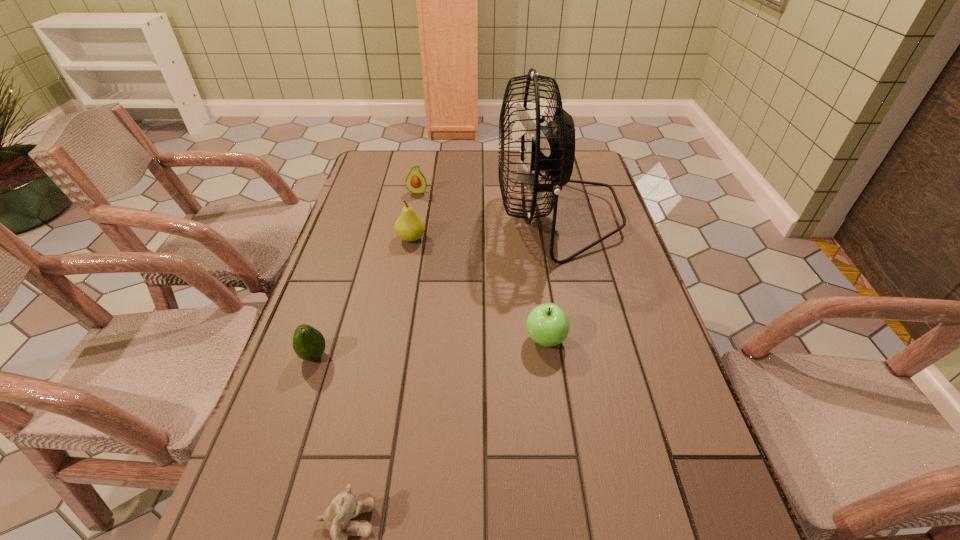
What are the coordinates of `the tallest object` in the screenshot? It's located at (551, 148).

You are a GUI agent. You are given a task and a screenshot of the screen. Output one action in this format:
    pyautogui.click(x=<x>, y=<y>)
    Task: Click on the fifth shortest object
    
    Given the screenshot: What is the action you would take?
    pyautogui.click(x=409, y=226)

At what (x,y) coordinates should I click in order to perform the action: click on the farther avocado. Please return your answer as a coordinate pair (x, y). This screenshot has height=540, width=960. Looking at the image, I should click on (415, 182).

Locate an element on the screen. Image resolution: width=960 pixels, height=540 pixels. apple is located at coordinates (548, 325).

Find the location of a particular element. the left avocado is located at coordinates (308, 343).

Locate an element on the screen. The width and height of the screenshot is (960, 540). the nearer avocado is located at coordinates (308, 343).

Locate an element on the screen. free region located 0.230m in front of the fan, directing airflow is located at coordinates (420, 215).

Identify the location of vacant space situated in front of the fan, directing airflow. (481, 215).

At what (x,y) coordinates should I click in order to perform the action: click on vacant space located in front of the fan, directing airflow. Please return your answer as a coordinate pair (x, y). Looking at the image, I should click on (470, 215).

You are a GUI agent. You are given a task and a screenshot of the screen. Output one action in this format:
    pyautogui.click(x=<x>, y=<y>)
    Task: Click on the vacant space located 0.080m on the right of the pear
    This screenshot has width=960, height=540.
    Given the screenshot: What is the action you would take?
    pyautogui.click(x=455, y=239)